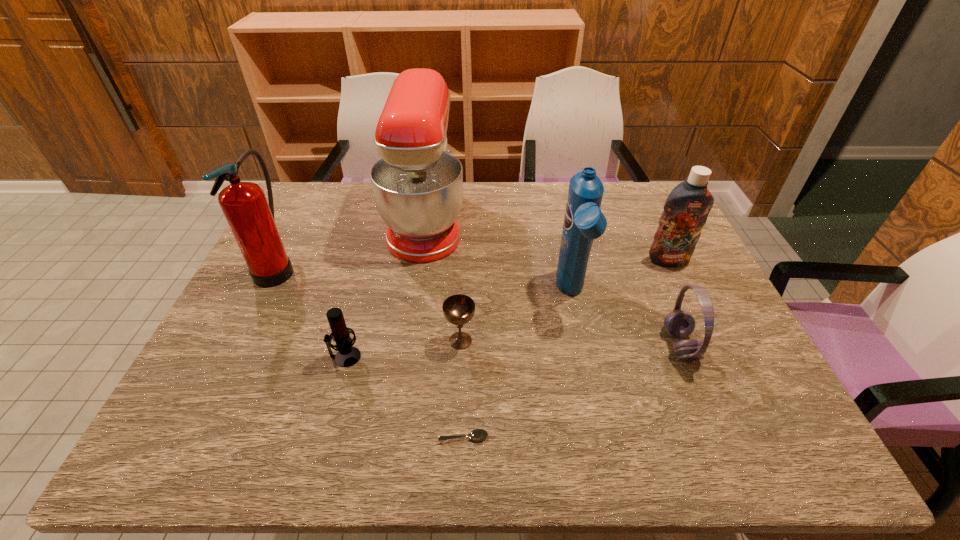
Where is `free location located 0.060m on the left of the shortest object`? free location located 0.060m on the left of the shortest object is located at coordinates (409, 437).

Where is `object at the far edge`? The width and height of the screenshot is (960, 540). object at the far edge is located at coordinates (x=417, y=183).

You are a GUI agent. You are given a task and a screenshot of the screen. Output one action in this format:
    pyautogui.click(x=<x>, y=<y>)
    Task: Click on the object located in the near edge section of the desktop
    The height and width of the screenshot is (540, 960).
    Given the screenshot: What is the action you would take?
    pyautogui.click(x=478, y=434)

Locate an element on the screen. This screenshot has width=960, height=540. object at the left edge is located at coordinates (251, 220).

Locate an element on the screen. The height and width of the screenshot is (540, 960). shampoo situated at the right edge is located at coordinates (686, 209).

The width and height of the screenshot is (960, 540). Find the location of `headset located in the right edge section of the desktop`. headset located in the right edge section of the desktop is located at coordinates (678, 323).

Identify the location of free space at the far edge. The height and width of the screenshot is (540, 960). (478, 185).

This screenshot has width=960, height=540. In the image, there is a desktop. Identify the location of vacant space at the near edge. (507, 437).

The width and height of the screenshot is (960, 540). Identify the location of vacant area at the right edge of the desktop. (725, 339).

Locate an element on the screen. Image resolution: width=960 pixels, height=540 pixels. vacant space at the near right corner of the desktop is located at coordinates (764, 454).